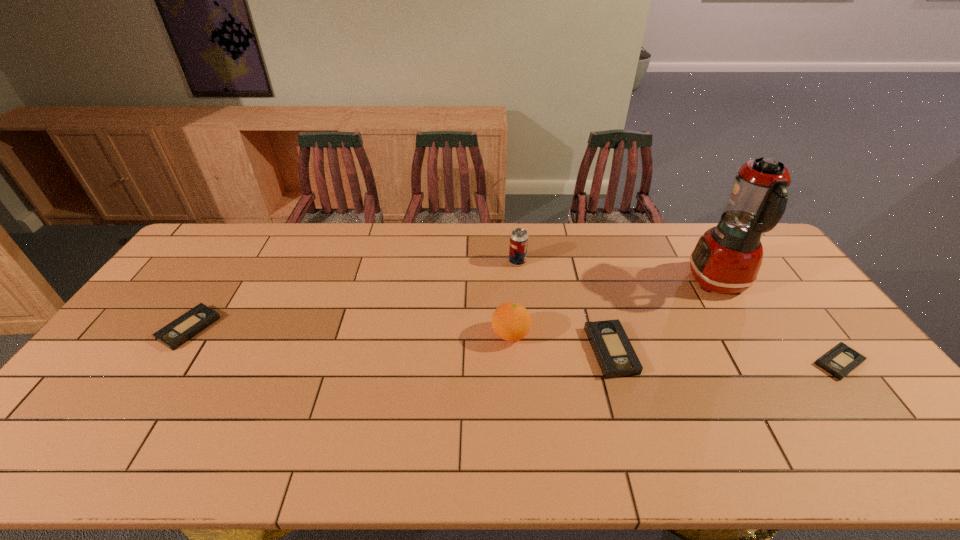
Where is `the leftmost object`? the leftmost object is located at coordinates (173, 335).

This screenshot has height=540, width=960. In order to click on the second shortest object in this screenshot , I will do `click(173, 335)`.

Locate an element on the screen. the third object from right to left is located at coordinates (616, 357).

At what (x,y) coordinates should I click in order to perform the action: click on the second videotape from left to right. Please return your answer as a coordinate pair (x, y). Looking at the image, I should click on (616, 357).

The height and width of the screenshot is (540, 960). Find the location of `the rightmost object`. the rightmost object is located at coordinates (841, 360).

Locate an element on the screen. The width and height of the screenshot is (960, 540). the shortest object is located at coordinates (841, 360).

Find the location of `beer can`. beer can is located at coordinates (518, 246).

Find the location of a particular element. Image resolution: width=960 pixels, height=540 pixels. the tallest object is located at coordinates (727, 258).

Identify the location of the fifth object from left to right. This screenshot has width=960, height=540. (727, 258).

At what (x,y) coordinates should I click in order to perform the action: click on orange. Please return your answer as a coordinate pair (x, y). This screenshot has width=960, height=540. Looking at the image, I should click on (510, 321).